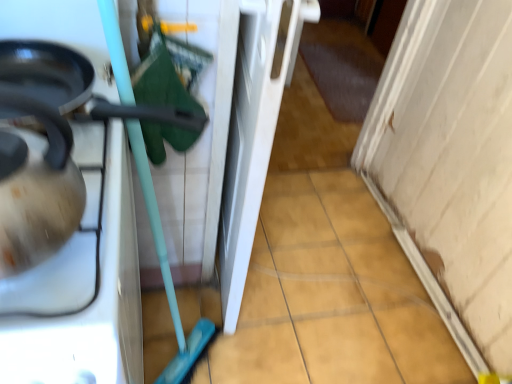
Question: Is shiny black frying pan at left positioned far away from matte white tea pot at left?

Choices:
 (A) yes
 (B) no

Answer: (B)

Question: Is shiny black frying pan at left oriented towards matte white tea pot at left?

Choices:
 (A) no
 (B) yes

Answer: (B)

Question: From the image's perspective, is shiny black frying pan at left on top of matte white tea pot at left?

Choices:
 (A) yes
 (B) no

Answer: (A)

Question: Is shiny black frying pan at left smaller than matte white tea pot at left?

Choices:
 (A) no
 (B) yes

Answer: (A)

Question: From a real-world perspective, does shiny black frying pan at left stand above matte white tea pot at left?

Choices:
 (A) no
 (B) yes

Answer: (A)

Question: Is shiny black frying pan at left situated inside matte white tea pot at left or outside?

Choices:
 (A) outside
 (B) inside

Answer: (A)

Question: Based on their positions, is shiny black frying pan at left located to the left or right of matte white tea pot at left?

Choices:
 (A) right
 (B) left

Answer: (A)

Question: Does point (136, 109) appear closer or farther from the camera than point (54, 119)?

Choices:
 (A) farther
 (B) closer

Answer: (A)

Question: From the image's perspective, is shiny black frying pan at left located above or below matte white tea pot at left?

Choices:
 (A) above
 (B) below

Answer: (A)

Question: Does point (35, 82) appear closer or farther from the camera than point (92, 46)?

Choices:
 (A) closer
 (B) farther

Answer: (A)

Question: Based on their sizes in the image, would you say shiny black frying pan at left is bigger or smaller than matte black kettle at left?

Choices:
 (A) small
 (B) big

Answer: (A)

Question: From the image's perspective, relative to matte black kettle at left, is shiny black frying pan at left above or below?

Choices:
 (A) above
 (B) below

Answer: (A)

Question: Considering the positions of shiny black frying pan at left and matte black kettle at left in the image, is shiny black frying pan at left wider or thinner than matte black kettle at left?

Choices:
 (A) wide
 (B) thin

Answer: (B)

Question: Considering the positions of matte black kettle at left and matte white tea pot at left in the image, is matte black kettle at left taller or shorter than matte white tea pot at left?

Choices:
 (A) tall
 (B) short

Answer: (B)

Question: From a real-world perspective, relative to matte white tea pot at left, is matte black kettle at left vertically above or below?

Choices:
 (A) below
 (B) above

Answer: (A)